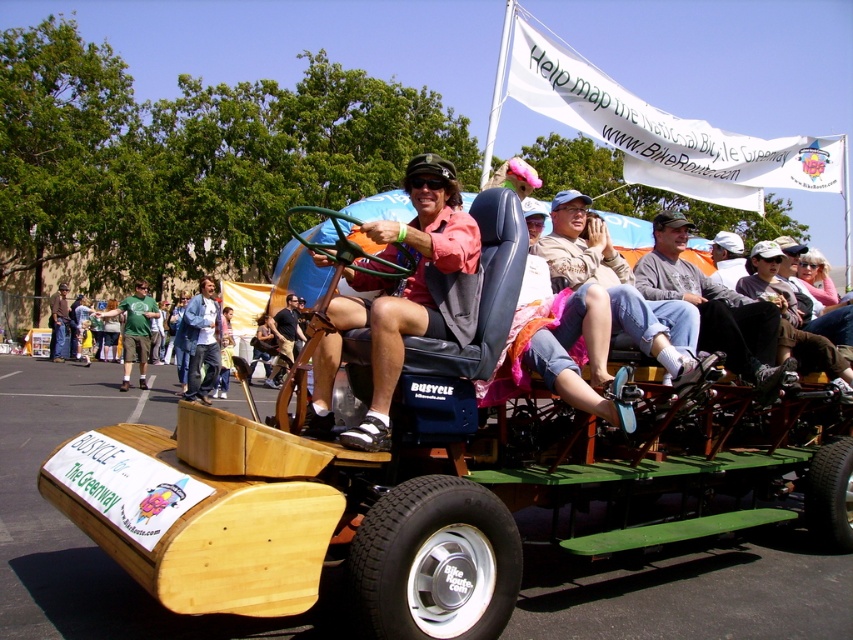
Question: Observing the image, what is the correct spatial positioning of matte pink shirt at center in reference to denim jacket at center?

Choices:
 (A) below
 (B) above

Answer: (B)

Question: Does matte pink shirt at center have a greater width compared to denim jeans at center?

Choices:
 (A) yes
 (B) no

Answer: (B)

Question: Which point appears closest to the camera in this image?

Choices:
 (A) (x=637, y=328)
 (B) (x=183, y=330)
 (C) (x=697, y=304)
 (D) (x=434, y=289)

Answer: (D)

Question: Can you confirm if matte pink shirt at center is positioned to the left of gray cotton shirt at center?

Choices:
 (A) yes
 (B) no

Answer: (A)

Question: Among these points, which one is farthest from the camera?

Choices:
 (A) (199, 321)
 (B) (448, 260)
 (C) (589, 236)

Answer: (A)

Question: Estimate the real-world distances between objects in this image. Which object is closer to the denim jacket at center?

Choices:
 (A) denim jeans at center
 (B) matte pink shirt at center
 (C) gray cotton shirt at center

Answer: (C)